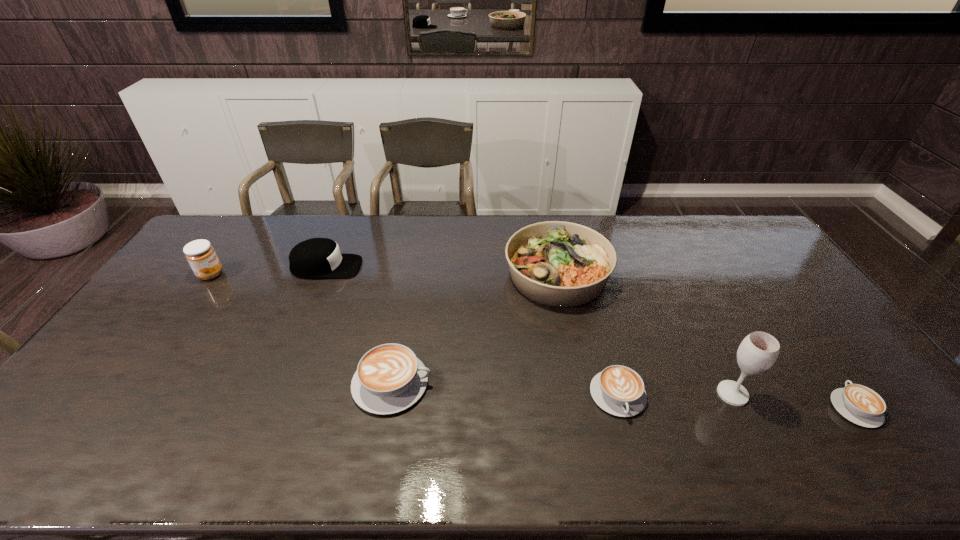
Find the location of a particular element. The height and width of the screenshot is (540, 960). the third shortest object is located at coordinates (389, 378).

Locate an element on the screen. The height and width of the screenshot is (540, 960). the tallest cappuccino is located at coordinates (389, 378).

Locate an element on the screen. Image resolution: width=960 pixels, height=540 pixels. the second shortest object is located at coordinates 618,390.

The height and width of the screenshot is (540, 960). In order to click on the second tallest cappuccino in this screenshot , I will do `click(618, 390)`.

Identify the location of the shortest object. Image resolution: width=960 pixels, height=540 pixels. (859, 404).

At what (x,y) coordinates should I click in order to perform the action: click on the shortest cappuccino. Please return your answer as a coordinate pair (x, y). The image size is (960, 540). Looking at the image, I should click on (859, 404).

Locate an element on the screen. The image size is (960, 540). jam is located at coordinates (201, 256).

Locate an element on the screen. salad plate is located at coordinates (556, 263).

I want to click on the sixth object from right to left, so click(317, 257).

Find the location of `the tallest object`. the tallest object is located at coordinates 758,351.